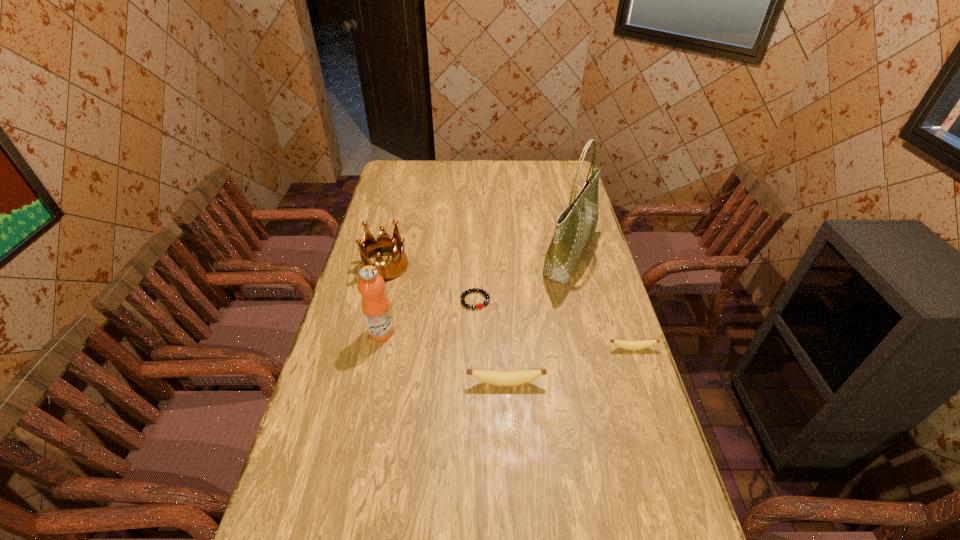
Image resolution: width=960 pixels, height=540 pixels. Identify the location of free space for a new banana on the left. (359, 423).